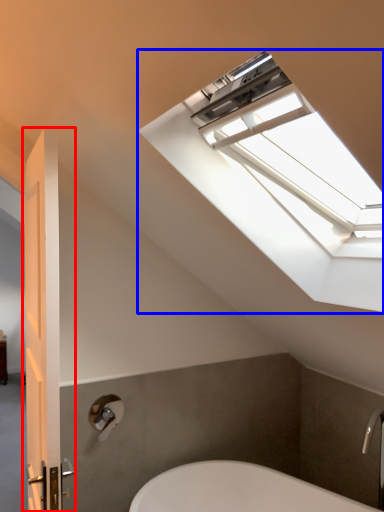
Question: Which of the following is the closest to the observer, door (highlighted by a red box) or window (highlighted by a blue box)?

Choices:
 (A) door
 (B) window

Answer: (B)